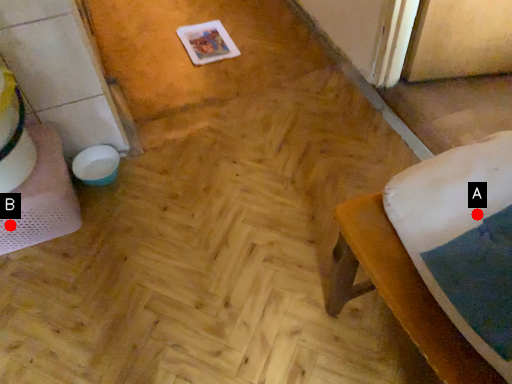
Question: Two points are circled on the image, labeled by A and B beside each circle. Among these points, which one is nearest to the camera?

Choices:
 (A) A is closer
 (B) B is closer

Answer: (A)